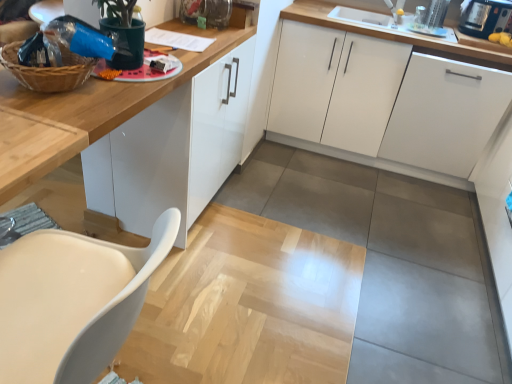
Image resolution: width=512 pixels, height=384 pixels. Describe the element at coordinates (445, 114) in the screenshot. I see `white matte cabinet at right, the third cabinetry viewed from the left` at that location.

The height and width of the screenshot is (384, 512). Describe the element at coordinates (33, 148) in the screenshot. I see `natural wood table at left` at that location.

What do you see at coordinates (48, 70) in the screenshot?
I see `woven brown basket at upper left` at bounding box center [48, 70].

Find the location of `white glossy cabinet at upper center, the 3th cabinetry when ordered from right to left`. white glossy cabinet at upper center, the 3th cabinetry when ordered from right to left is located at coordinates (173, 149).

You are a GUI agent. You are given a task and a screenshot of the screen. Output one action in this format:
    pyautogui.click(x=<x>, y=<y>)
    Task: Click on the white matte cabinet at right, the third cabinetry viewed from the left
    This screenshot has height=384, width=512.
    Given the screenshot: What is the action you would take?
    445,114

Is black plastic toaster at upper right surrounded by white glossy cabinet at upper center, the first cabinetry when ordered from left to right?

No, black plastic toaster at upper right is located outside of white glossy cabinet at upper center, the first cabinetry when ordered from left to right.

Identify the location of the 2nd cabinetry positioned below the black plastic toaster at upper right (from a real-world perspective). (173, 149).

Can you see white glossy cabinet at upper center, the first cabinetry when ordered from left to right, touching black plastic toaster at upper right?

No, white glossy cabinet at upper center, the first cabinetry when ordered from left to right, is not in contact with black plastic toaster at upper right.

Is point (236, 48) closer to camera compared to point (497, 3)?

Yes.

Is white matte cabinet at center, which is the second cabinetry in left-to-right order, oriented towards natural wood table at left?

Yes, white matte cabinet at center, which is the second cabinetry in left-to-right order, faces towards natural wood table at left.

Consider the image. Which object is positioned more to the left, white matte cabinet at center, the 2th cabinetry when ordered from right to left, or natural wood table at left?

natural wood table at left is more to the left.

Can you confirm if white matte cabinet at center, the 2th cabinetry when ordered from right to left, is shorter than natural wood table at left?

No.

Would you say white matte cabinet at center, which is the second cabinetry in left-to-right order, is outside black plastic toaster at upper right?

Answer: Yes.

Is white matte cabinet at center, the 2th cabinetry when ordered from right to left, positioned with its back to black plastic toaster at upper right?

white matte cabinet at center, the 2th cabinetry when ordered from right to left, does not have its back to black plastic toaster at upper right.

In the scene shown: Looking at their sizes, would you say white matte cabinet at center, which is the second cabinetry in left-to-right order, is wider or thinner than black plastic toaster at upper right?

Considering their sizes, white matte cabinet at center, which is the second cabinetry in left-to-right order, looks broader than black plastic toaster at upper right.

Does white matte cabinet at center, the 2th cabinetry when ordered from right to left, lie behind black plastic toaster at upper right?

No.

From a real-world perspective, does white matte cabinet at right, the third cabinetry viewed from the left, stand above white glossy cabinet at upper center, the 3th cabinetry when ordered from right to left?

Incorrect, from a real-world perspective, white matte cabinet at right, the third cabinetry viewed from the left, is lower than white glossy cabinet at upper center, the 3th cabinetry when ordered from right to left.

Is white matte cabinet at right, the third cabinetry viewed from the left, at the left side of white glossy cabinet at upper center, the first cabinetry when ordered from left to right?

No, white matte cabinet at right, the third cabinetry viewed from the left, is not to the left of white glossy cabinet at upper center, the first cabinetry when ordered from left to right.

Is white matte cabinet at right, the third cabinetry viewed from the left, shorter than white glossy cabinet at upper center, the 3th cabinetry when ordered from right to left?

Yes, white matte cabinet at right, the third cabinetry viewed from the left, is shorter than white glossy cabinet at upper center, the 3th cabinetry when ordered from right to left.

Is black plastic toaster at upper right in front of or behind white matte cabinet at center, which is the second cabinetry in left-to-right order, in the image?

Clearly, black plastic toaster at upper right is behind white matte cabinet at center, which is the second cabinetry in left-to-right order.

Considering the sizes of black plastic toaster at upper right and white matte cabinet at center, which is the second cabinetry in left-to-right order, in the image, is black plastic toaster at upper right taller or shorter than white matte cabinet at center, which is the second cabinetry in left-to-right order,?

In the image, black plastic toaster at upper right appears to be shorter than white matte cabinet at center, which is the second cabinetry in left-to-right order.

Between point (477, 1) and point (309, 123), which one is positioned behind?

Point (309, 123)

From a real-world perspective, which is physically above, white matte cabinet at right, the first cabinetry from the right, or woven brown basket at upper left?

In real-world perspective, woven brown basket at upper left is above.

Can you confirm if white matte cabinet at right, the third cabinetry viewed from the left, is smaller than woven brown basket at upper left?

No, white matte cabinet at right, the third cabinetry viewed from the left, is not smaller than woven brown basket at upper left.

Can you confirm if white matte cabinet at right, the first cabinetry from the right, is wider than woven brown basket at upper left?

Yes.

Considering the relative sizes of woven brown basket at upper left and white glossy cabinet at upper center, the 3th cabinetry when ordered from right to left, in the image provided, is woven brown basket at upper left shorter than white glossy cabinet at upper center, the 3th cabinetry when ordered from right to left,?

Correct, woven brown basket at upper left is not as tall as white glossy cabinet at upper center, the 3th cabinetry when ordered from right to left.

Where is `the 2nd cabinetry directly beneath the woven brown basket at upper left (from a real-world perspective)`? Image resolution: width=512 pixels, height=384 pixels. the 2nd cabinetry directly beneath the woven brown basket at upper left (from a real-world perspective) is located at coordinates (173, 149).

Which is behind, woven brown basket at upper left or white glossy cabinet at upper center, the 3th cabinetry when ordered from right to left?

white glossy cabinet at upper center, the 3th cabinetry when ordered from right to left, is further away from the camera.

Is white glossy cabinet at upper center, the 3th cabinetry when ordered from right to left, at the back of woven brown basket at upper left?

No, woven brown basket at upper left's orientation is not away from white glossy cabinet at upper center, the 3th cabinetry when ordered from right to left.

Find the location of a particular element. appliance behind the white glossy cabinet at upper center, the first cabinetry when ordered from left to right is located at coordinates (485, 17).

Starting from the natural wood table at left, which cabinetry is the 2nd one to the right? Please provide its 2D coordinates.

[(384, 99)]

Looking at this image, looking at the image, which one is located closer to white matte chair at lower left, natural wood table at left or white matte cabinet at right, the first cabinetry from the right?

Based on the image, natural wood table at left appears to be nearer to white matte chair at lower left.

Considering their positions, is white matte chair at lower left positioned closer to white matte cabinet at center, the 2th cabinetry when ordered from right to left, than black plastic toaster at upper right?

black plastic toaster at upper right.

Considering their positions, is white matte cabinet at right, the third cabinetry viewed from the left, positioned closer to black plastic toaster at upper right than woven brown basket at upper left?

white matte cabinet at right, the third cabinetry viewed from the left, is positioned closer to the anchor black plastic toaster at upper right.

Based on their spatial positions, is white matte cabinet at right, the first cabinetry from the right, or natural wood table at left further from white matte cabinet at center, which is the second cabinetry in left-to-right order?

natural wood table at left.

Based on their spatial positions, is white glossy cabinet at upper center, the first cabinetry when ordered from left to right, or natural wood table at left closer to woven brown basket at upper left?

natural wood table at left.

Based on the photo, when comparing their distances from black plastic toaster at upper right, does natural wood table at left or white glossy cabinet at upper center, the first cabinetry when ordered from left to right, seem further?

The object further to black plastic toaster at upper right is natural wood table at left.

Looking at this image, from the image, which object appears to be farther from white matte chair at lower left, white matte cabinet at right, the third cabinetry viewed from the left, or natural wood table at left?

Based on the image, white matte cabinet at right, the third cabinetry viewed from the left, appears to be further to white matte chair at lower left.

Looking at the image, which one is located further to white matte cabinet at right, the first cabinetry from the right, black plastic toaster at upper right or woven brown basket at upper left?

woven brown basket at upper left.

Find the location of `table between white matte chair at lower left and white glossy cabinet at upper center, the first cabinetry when ordered from left to right, along the z-axis`. table between white matte chair at lower left and white glossy cabinet at upper center, the first cabinetry when ordered from left to right, along the z-axis is located at coordinates (33, 148).

The image size is (512, 384). I want to click on chair between woven brown basket at upper left and black plastic toaster at upper right from left to right, so click(x=72, y=301).

Find the location of `basket between white matte chair at lower left and white glossy cabinet at upper center, the 3th cabinetry when ordered from right to left, from front to back`. basket between white matte chair at lower left and white glossy cabinet at upper center, the 3th cabinetry when ordered from right to left, from front to back is located at coordinates (48, 70).

You are a GUI agent. You are given a task and a screenshot of the screen. Output one action in this format:
    pyautogui.click(x=<x>, y=<y>)
    Task: Click on the chair between natural wood table at left and white matte cabinet at right, the first cabinetry from the right, from left to right
    The width and height of the screenshot is (512, 384).
    Given the screenshot: What is the action you would take?
    pyautogui.click(x=72, y=301)